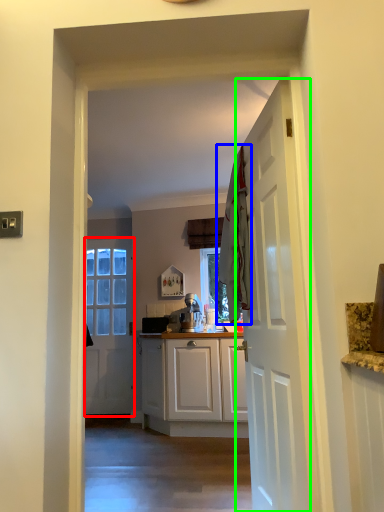
Question: Which is nearer to the door (highlighted by a red box)? laundry (highlighted by a blue box) or door (highlighted by a green box).

Choices:
 (A) laundry
 (B) door

Answer: (A)